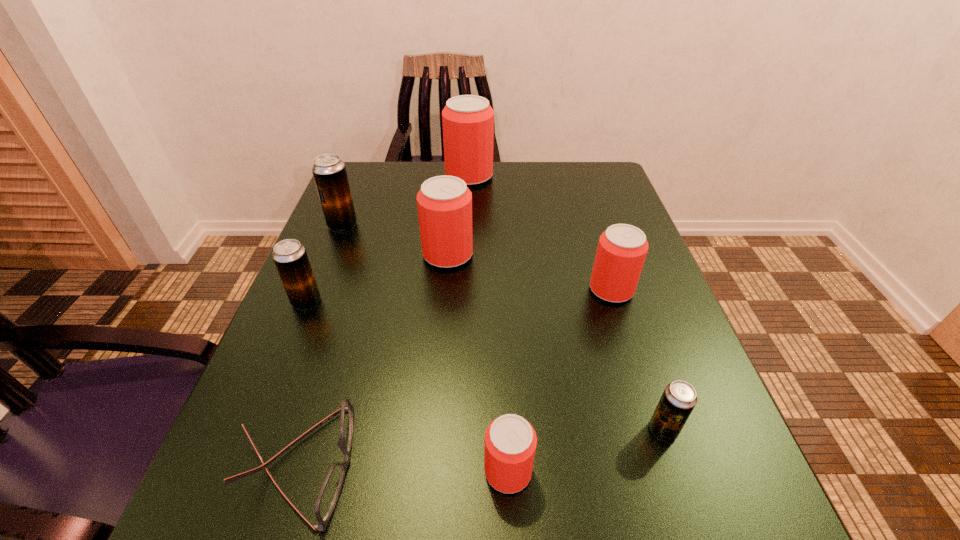
Find the location of a particular element. This screenshot has width=960, height=540. free space at the right edge of the desktop is located at coordinates click(611, 220).

In the image, there is a desktop. Where is `free region at the far left corner`? free region at the far left corner is located at coordinates (388, 199).

Find the location of a particular element. This screenshot has width=960, height=540. vacant space at the near left corner of the desktop is located at coordinates (258, 538).

Locate an element on the screen. Image resolution: width=960 pixels, height=540 pixels. vacant area at the far right corner is located at coordinates (611, 195).

The image size is (960, 540). Find the location of `free space between the farthest beer can and the nearest beer can`. free space between the farthest beer can and the nearest beer can is located at coordinates (489, 323).

Where is `free space between the smallest black beer can and the biggest black beer can`? This screenshot has height=540, width=960. free space between the smallest black beer can and the biggest black beer can is located at coordinates (503, 327).

Identify the location of free space between the spectacles and the biggest black beer can. (320, 345).

This screenshot has height=540, width=960. Identify the location of vacant area between the farthest black beer can and the third farthest beer can. (396, 240).

You are a GUI agent. You are given a task and a screenshot of the screen. Output one action in this format:
    pyautogui.click(x=<x>, y=<y>)
    Task: Click on the empty location between the spectacles and the second farthest black beer can
    
    Given the screenshot: What is the action you would take?
    pyautogui.click(x=301, y=383)

Where is `free spot between the second biggest black beer can and the nearest beer can`? This screenshot has height=540, width=960. free spot between the second biggest black beer can and the nearest beer can is located at coordinates coord(407,386).